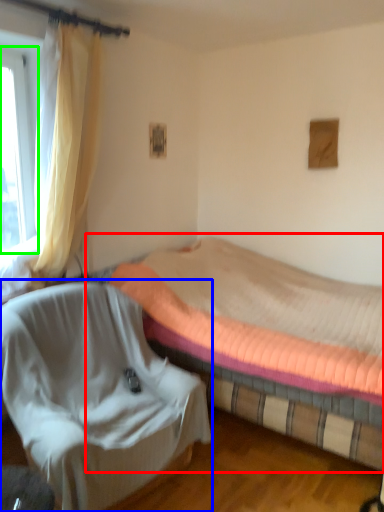
Question: Considering the real-world distances, which object is farthest from bed (highlighted by a red box)? chair (highlighted by a blue box) or window (highlighted by a green box)?

Choices:
 (A) chair
 (B) window

Answer: (B)